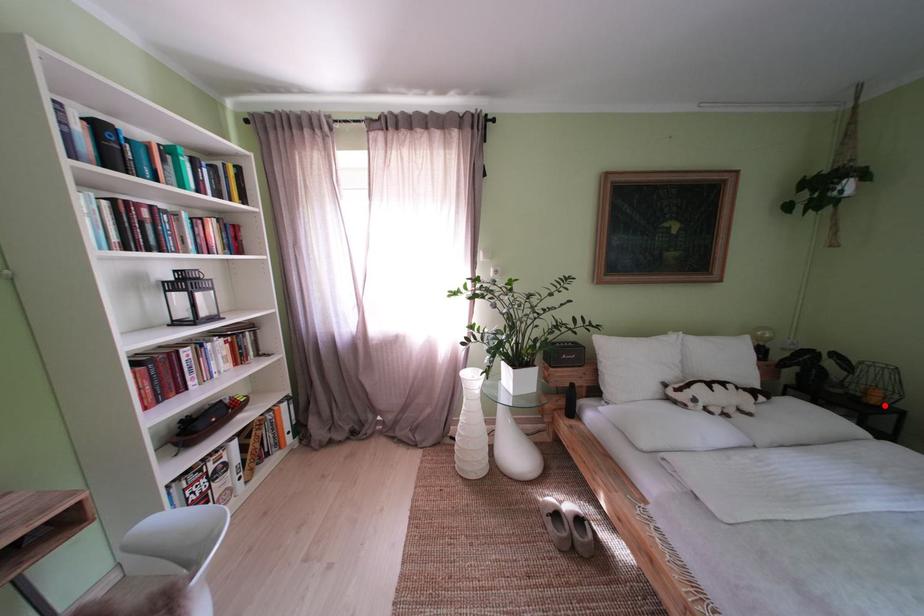
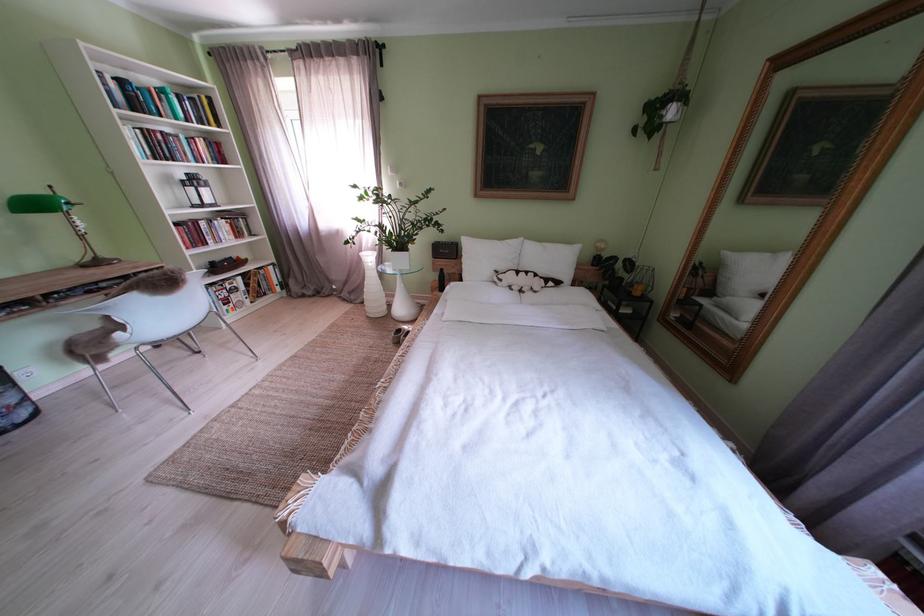
Question: I am providing you with two images of the same scene from different viewpoints. A red point is shown in image1. For the corresponding object point in image2, is it positioned nearer or farther from the camera?

Choices:
 (A) Nearer
 (B) Farther

Answer: (A)